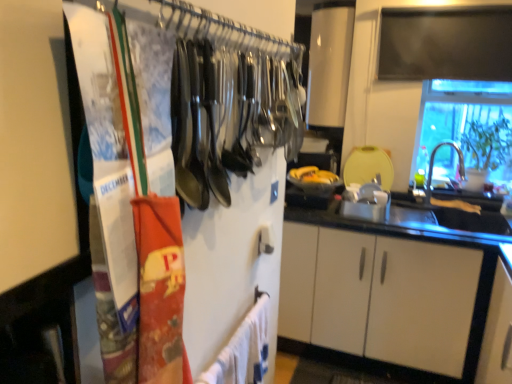
Question: Does metallic silver utensils at upper left have a lesser width compared to white cotton bath towel at lower center?

Choices:
 (A) no
 (B) yes

Answer: (B)

Question: Is metallic silver utensils at upper left to the left of white cotton bath towel at lower center from the viewer's perspective?

Choices:
 (A) yes
 (B) no

Answer: (A)

Question: Could you tell me if metallic silver utensils at upper left is facing white cotton bath towel at lower center?

Choices:
 (A) no
 (B) yes

Answer: (A)

Question: Is metallic silver utensils at upper left turned away from white cotton bath towel at lower center?

Choices:
 (A) yes
 (B) no

Answer: (B)

Question: Does metallic silver utensils at upper left lie behind white cotton bath towel at lower center?

Choices:
 (A) yes
 (B) no

Answer: (B)

Question: Does point [444, 114] appear closer or farther from the camera than point [431, 165]?

Choices:
 (A) farther
 (B) closer

Answer: (A)

Question: Is transparent glass window at upper right bigger or smaller than silver metallic faucet at right?

Choices:
 (A) small
 (B) big

Answer: (B)

Question: Considering the positions of transparent glass window at upper right and silver metallic faucet at right in the image, is transparent glass window at upper right wider or thinner than silver metallic faucet at right?

Choices:
 (A) thin
 (B) wide

Answer: (B)

Question: In the image, is transparent glass window at upper right positioned in front of or behind silver metallic faucet at right?

Choices:
 (A) front
 (B) behind

Answer: (A)

Question: Is transparent glass window at upper right taller or shorter than metallic silver utensils at upper left?

Choices:
 (A) short
 (B) tall

Answer: (B)

Question: In terms of size, does transparent glass window at upper right appear bigger or smaller than metallic silver utensils at upper left?

Choices:
 (A) small
 (B) big

Answer: (B)

Question: From the image's perspective, is transparent glass window at upper right above or below metallic silver utensils at upper left?

Choices:
 (A) above
 (B) below

Answer: (A)

Question: In the image, is transparent glass window at upper right positioned in front of or behind metallic silver utensils at upper left?

Choices:
 (A) front
 (B) behind

Answer: (B)

Question: Considering the positions of silver metallic faucet at right and metallic silver utensils at upper left in the image, is silver metallic faucet at right bigger or smaller than metallic silver utensils at upper left?

Choices:
 (A) big
 (B) small

Answer: (B)

Question: Is point click(x=430, y=193) closer or farther from the camera than point click(x=101, y=218)?

Choices:
 (A) closer
 (B) farther

Answer: (B)